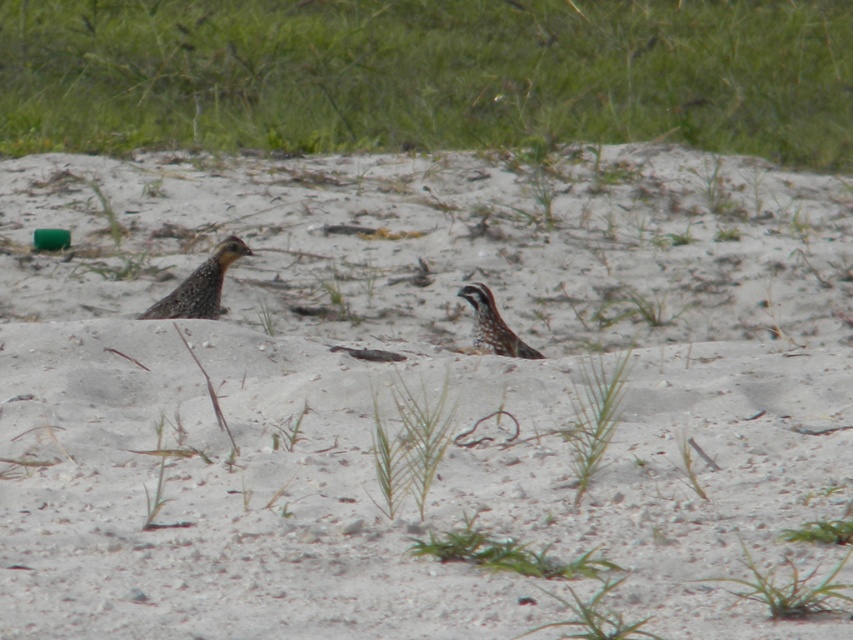
Consider the image. You are a photographer trying to capture both birds in a single shot. Given that your camera can only focus on objects within a 1.5 meter width, can you fit both the speckled brown bird at left and the speckled brown bird at center into the frame without exceeding the width limit?

The speckled brown bird at left is larger in width than the speckled brown bird at center. However, the total width of both birds combined may still be within the 1.5 meter limit if they are positioned closely together. To determine this, you would need to measure their individual widths and add them. Since the exact widths aren